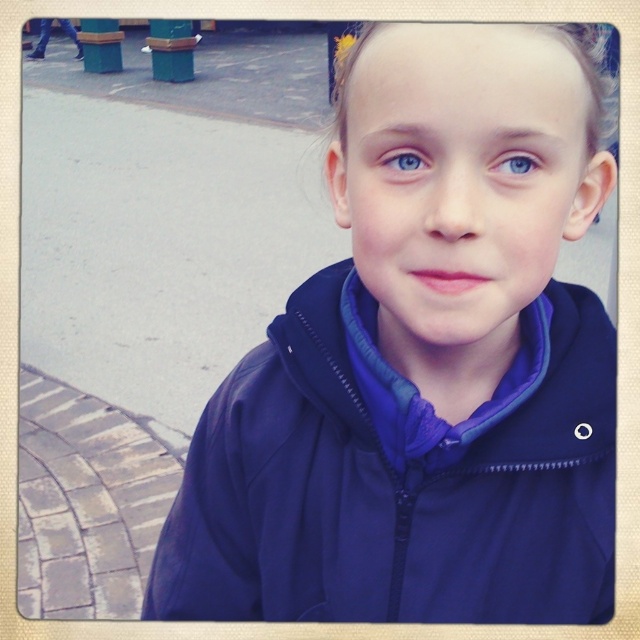
Question: Is blue matte eye at center smaller than blue matte eye at upper center?

Choices:
 (A) no
 (B) yes

Answer: (A)

Question: Can you confirm if blue matte eye at center is wider than blue matte eye at upper center?

Choices:
 (A) yes
 (B) no

Answer: (A)

Question: Which object is farther from the camera taking this photo?

Choices:
 (A) dark blue jacket at center
 (B) blue matte eye at center

Answer: (B)

Question: Which point is closer to the camera taking this photo?

Choices:
 (A) (502, 168)
 (B) (406, 154)

Answer: (A)

Question: Which is farther from the blue matte eye at center?

Choices:
 (A) dark blue jacket at center
 (B) blue matte eye at upper center

Answer: (A)

Question: Can you confirm if blue matte eye at center is smaller than blue matte eye at upper center?

Choices:
 (A) no
 (B) yes

Answer: (A)